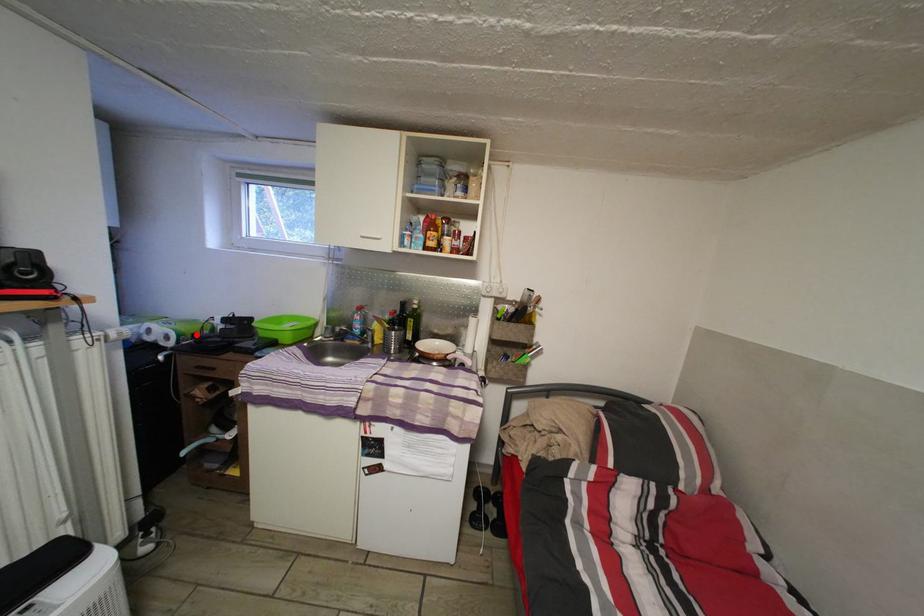
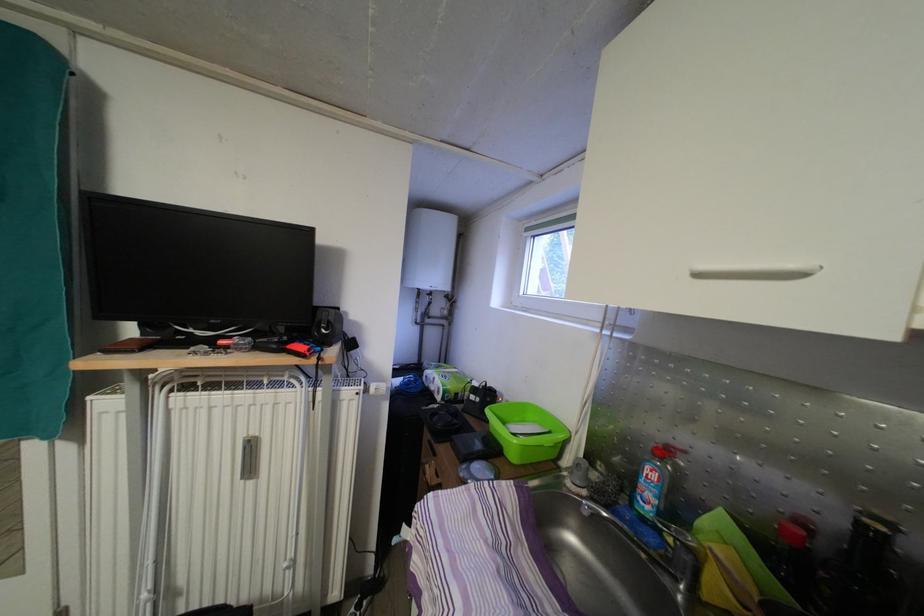
Find the pixel in the second image that matches the highlighted location in the first image.

(460, 394)